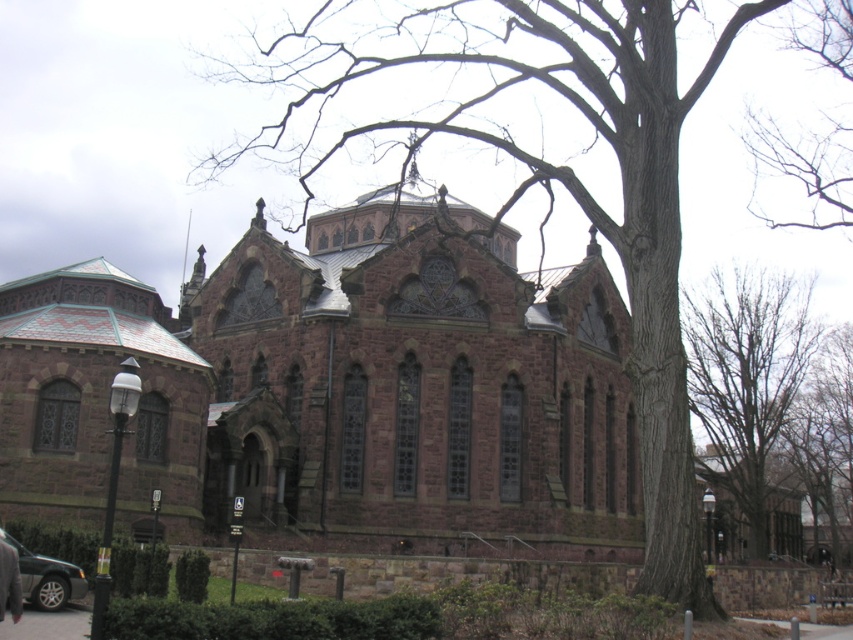
Can you confirm if brown stone church at center is positioned below bare branches at upper right?

No, brown stone church at center is not below bare branches at upper right.

How distant is brown stone church at center from bare branches at upper right?

The distance of brown stone church at center from bare branches at upper right is 39.51 meters.

Who is more forward, [550,358] or [769,371]?

Point [550,358] is more forward.

Image resolution: width=853 pixels, height=640 pixels. Identify the location of brown stone church at center. (335, 392).

Which is more to the right, bare branches at upper right or matte black sedan at lower left?

bare branches at upper right is more to the right.

Is bare branches at upper right further to the viewer compared to matte black sedan at lower left?

Yes, bare branches at upper right is further from the viewer.

Image resolution: width=853 pixels, height=640 pixels. Describe the element at coordinates (747, 374) in the screenshot. I see `bare branches at upper right` at that location.

I want to click on bare branches at upper right, so click(747, 374).

Is point (337, 282) closer to camera compared to point (6, 534)?

No, it is not.

From the picture: Can you confirm if brown stone church at center is positioned above matte black sedan at lower left?

Yes.

Between point (405, 204) and point (51, 595), which one is positioned in front?

Point (51, 595) is in front.

The height and width of the screenshot is (640, 853). I want to click on brown stone church at center, so click(x=335, y=392).